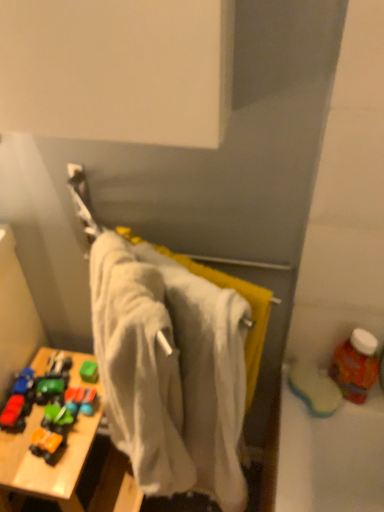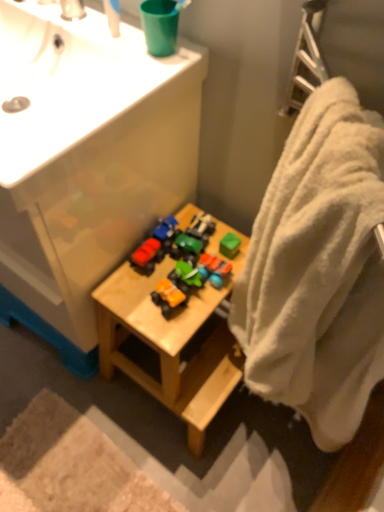
Question: How did the camera likely rotate when shooting the video?

Choices:
 (A) rotated right
 (B) rotated left

Answer: (B)